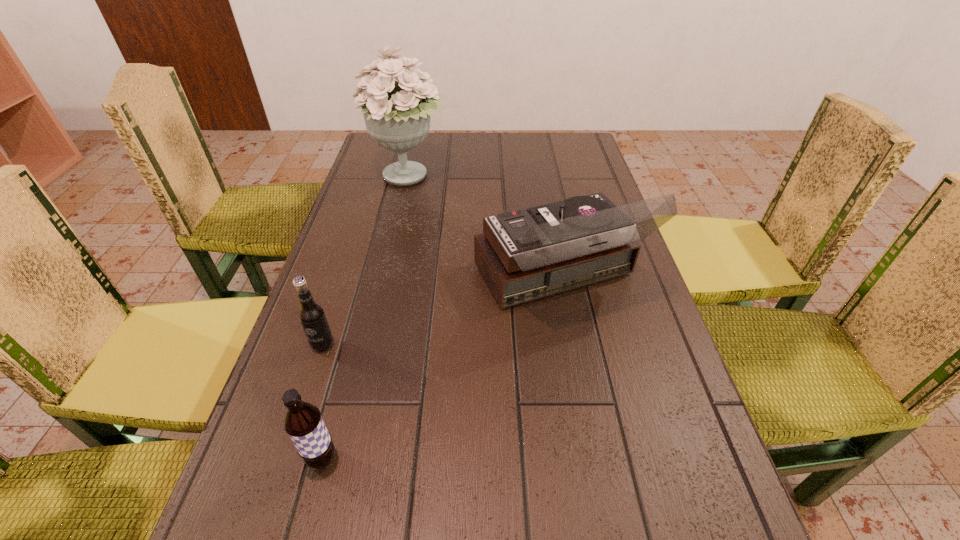
Locate an element on the screen. This screenshot has height=540, width=960. vacant area located on the label of the left root beer is located at coordinates pyautogui.click(x=276, y=490).

Locate an element on the screen. object located at the far edge is located at coordinates (397, 114).

At what (x,y) coordinates should I click in order to perform the action: click on bouquet that is at the left edge. Please return your answer as a coordinate pair (x, y). This screenshot has height=540, width=960. Looking at the image, I should click on (397, 114).

The width and height of the screenshot is (960, 540). I want to click on object that is at the right edge, so click(527, 254).

This screenshot has width=960, height=540. I want to click on object present at the far left corner, so click(x=397, y=114).

Where is `vacant space at the far edge of the desktop`? The height and width of the screenshot is (540, 960). vacant space at the far edge of the desktop is located at coordinates (521, 134).

Where is `vacant area at the left edge of the desktop`? vacant area at the left edge of the desktop is located at coordinates click(x=332, y=478).

Find the location of `free spot at the right edge of the desktop`. free spot at the right edge of the desktop is located at coordinates [x=657, y=343].

The width and height of the screenshot is (960, 540). In the image, there is a desktop. Find the location of `vacant space at the far left corner`. vacant space at the far left corner is located at coordinates (373, 151).

I want to click on vacant area at the far right corner of the desktop, so click(564, 147).